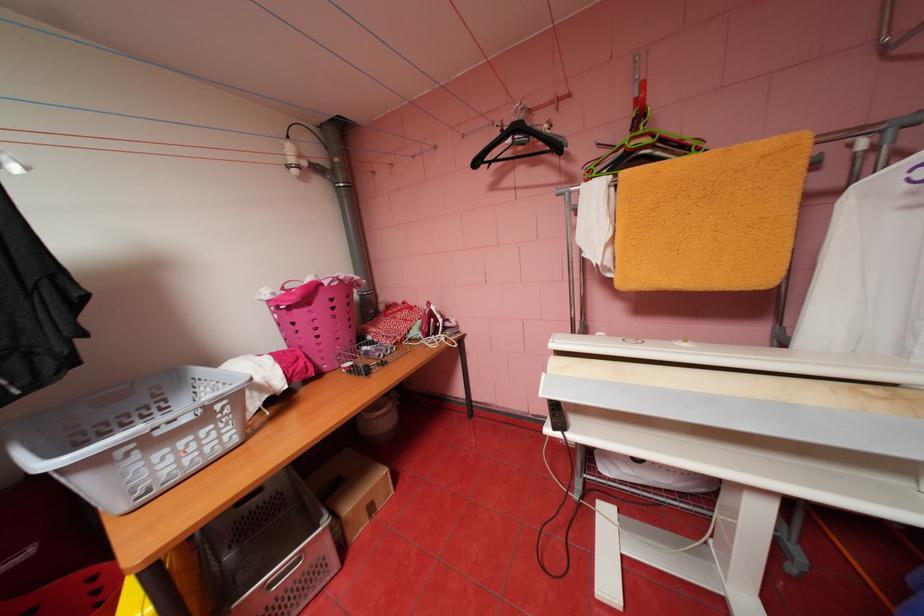
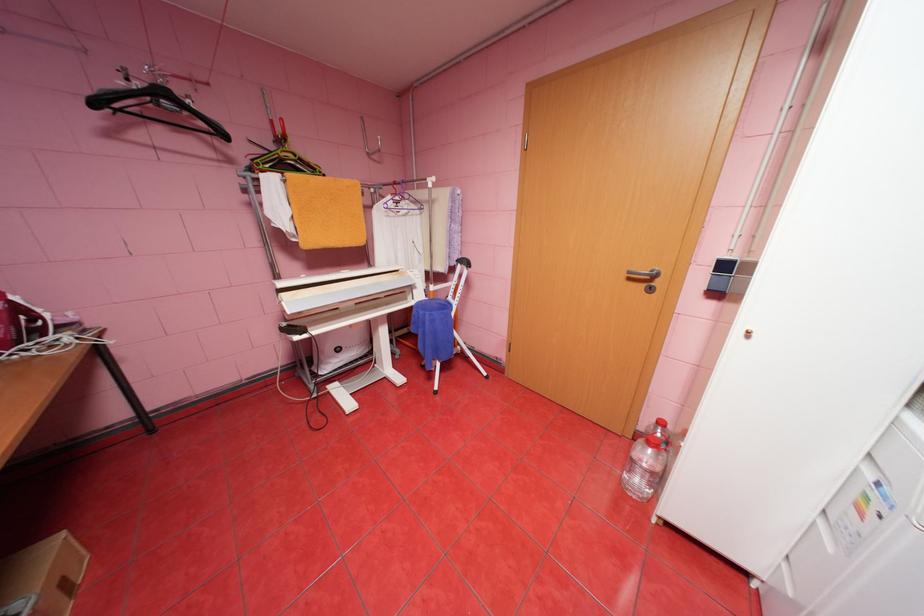
Locate, in the second image, the point that corresponds to point 440,314 in the first image.

(26, 309)